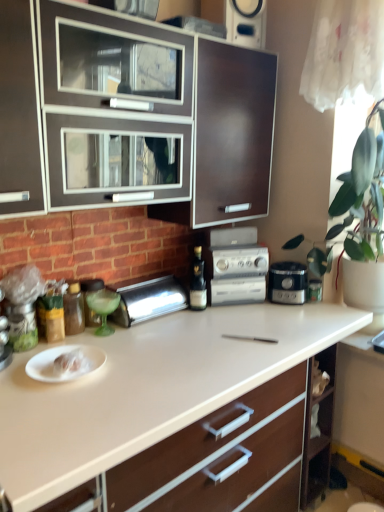
Locate an element on the screen. The width and height of the screenshot is (384, 512). empty space that is to the right of black glass bottle at center, which is the first bottle in right-to-left order is located at coordinates (233, 314).